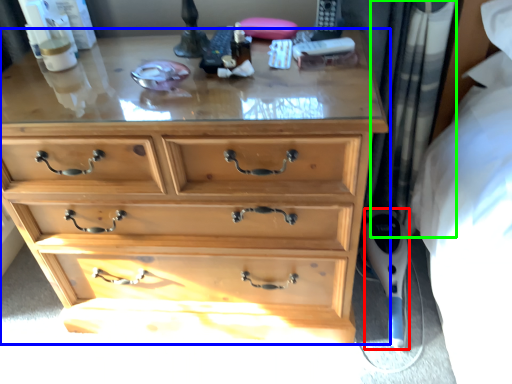
Question: Considering the real-world distances, which object is farthest from equipment (highlighted by a red box)? chest of drawers (highlighted by a blue box) or curtain (highlighted by a green box)?

Choices:
 (A) chest of drawers
 (B) curtain

Answer: (A)